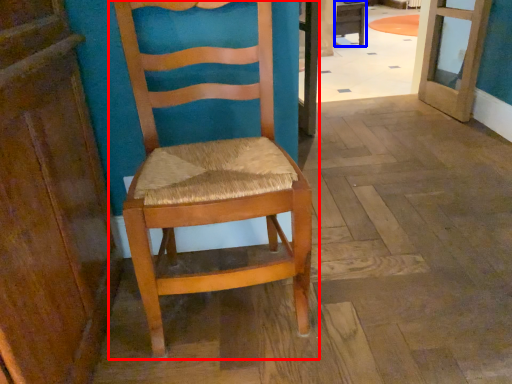
Question: Which point is further to the camera, chair (highlighted by a red box) or table (highlighted by a blue box)?

Choices:
 (A) chair
 (B) table

Answer: (B)